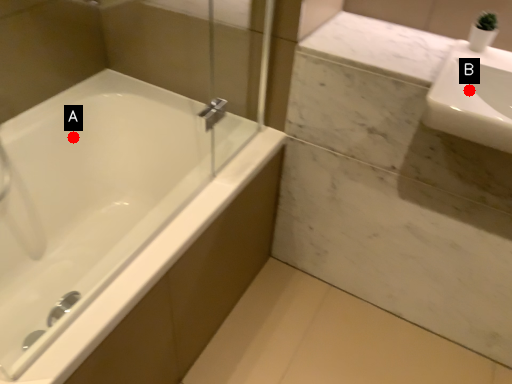
Question: Two points are circled on the image, labeled by A and B beside each circle. Which point is farther to the camera?

Choices:
 (A) A is further
 (B) B is further

Answer: (A)